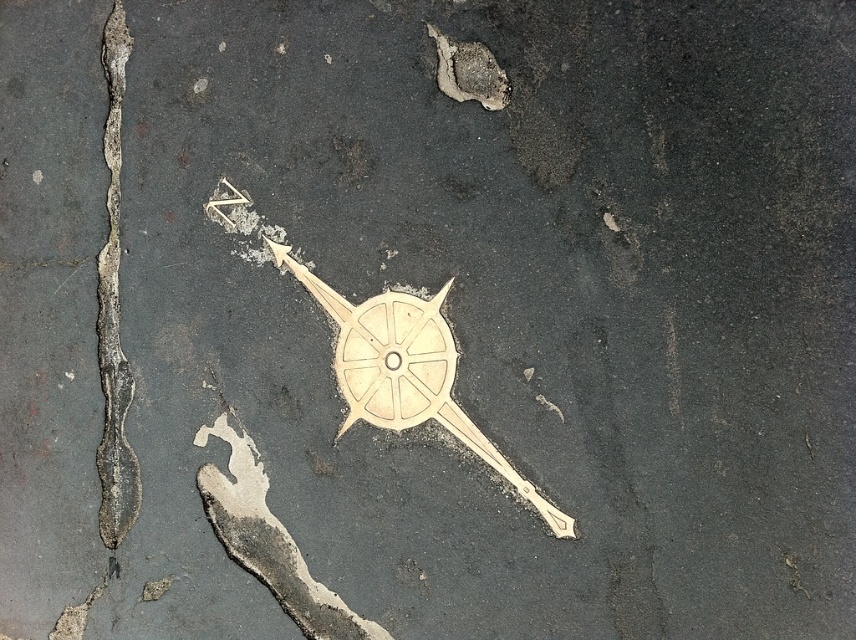
How far apart are white matte compass at center and dark gray cracked asphalt at left?

white matte compass at center is 9.81 meters away from dark gray cracked asphalt at left.

Who is higher up, white matte compass at center or dark gray cracked asphalt at left?

dark gray cracked asphalt at left is above.

Identify the location of white matte compass at center. [405, 371].